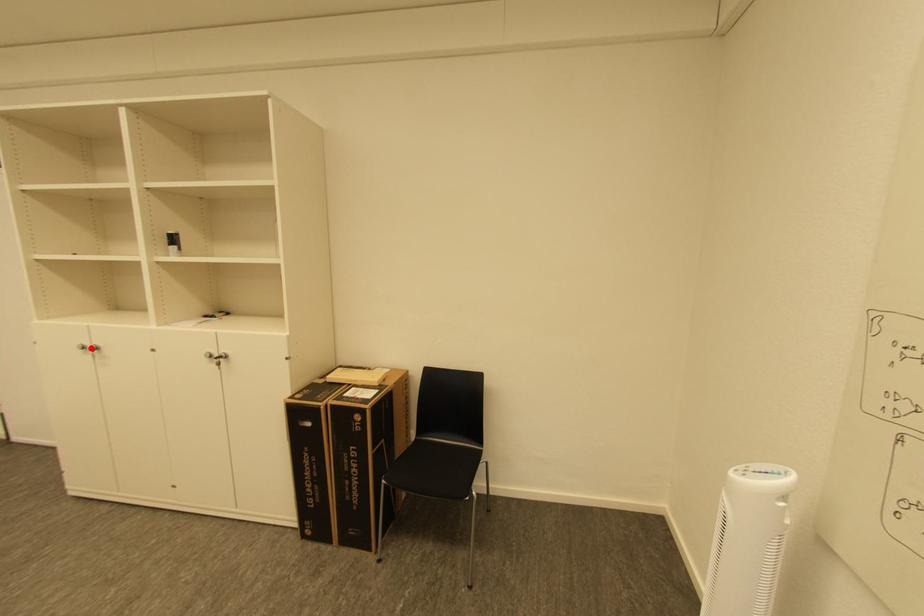
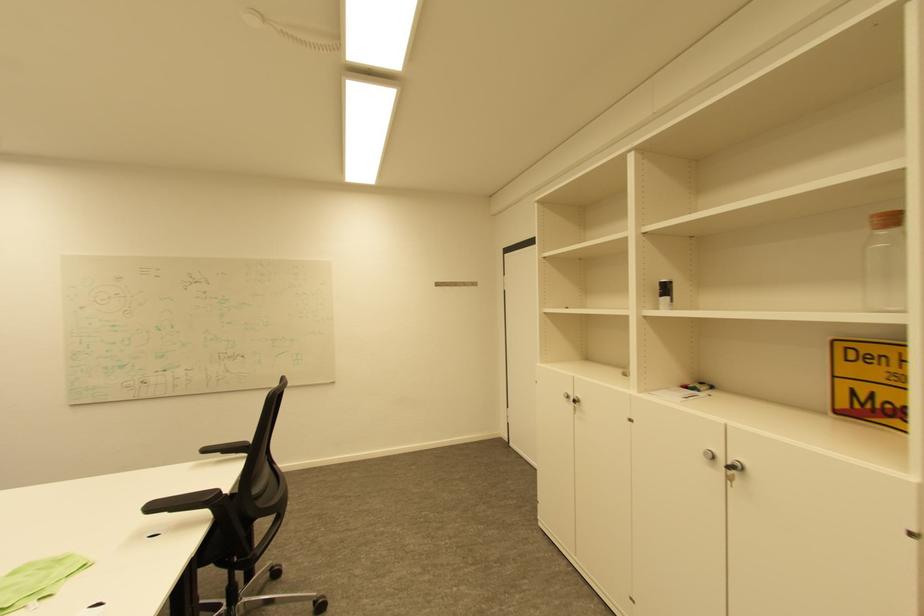
The point at the highlighted location is marked in the first image. Where is the corresponding point in the second image?

(574, 398)